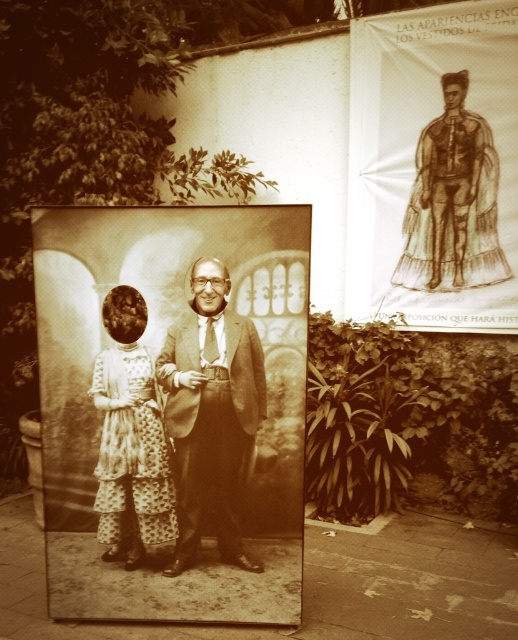
Question: Does brown paper poster at upper right appear over brown paper dress at upper right?

Choices:
 (A) no
 (B) yes

Answer: (B)

Question: Among these points, which one is farthest from the camera?

Choices:
 (A) (469, 145)
 (B) (387, 221)

Answer: (B)

Question: Which point is closer to the camera?

Choices:
 (A) sepia textured poster at center
 (B) brown paper poster at upper right

Answer: (A)

Question: Among these objects, which one is nearest to the camera?

Choices:
 (A) sepia textured poster at center
 (B) brown paper dress at upper right

Answer: (A)

Question: Is brown paper poster at upper right thinner than smooth brown suit at center?

Choices:
 (A) yes
 (B) no

Answer: (B)

Question: Observing the image, what is the correct spatial positioning of sepia textured poster at center in reference to patterned fabric dress at left?

Choices:
 (A) below
 (B) above

Answer: (B)